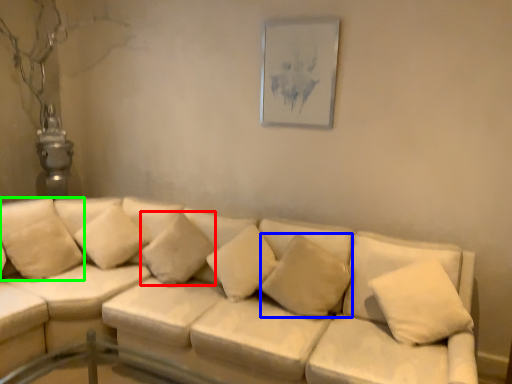
Question: Which is farther away from pillow (highlighted by a red box)? pillow (highlighted by a blue box) or pillow (highlighted by a green box)?

Choices:
 (A) pillow
 (B) pillow

Answer: (B)